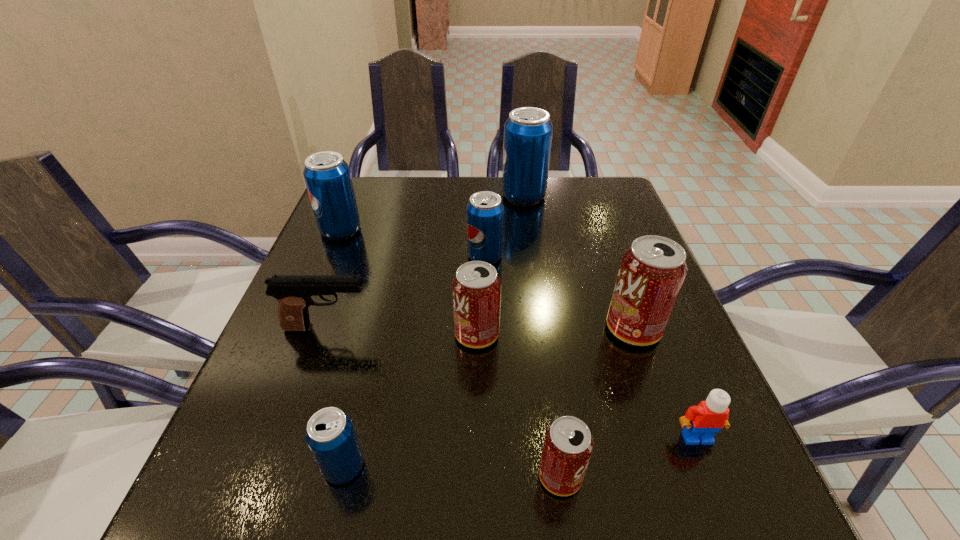
The width and height of the screenshot is (960, 540). What are the coordinates of `vacant region between the tallest object and the leftmost red soda can` in the screenshot? It's located at (500, 265).

At what (x,y) coordinates should I click in order to perform the action: click on free space between the rightmost red soda can and the nearest red soda can. Please return your answer as a coordinate pair (x, y). Looking at the image, I should click on (597, 402).

Point out which object is positioned as the eighth nearest to the black pistol. Please provide its 2D coordinates. Your answer should be formatted as a tuple, i.e. [(x, y)], where the tuple contains the x and y coordinates of a point satisfying the conditions above.

[(702, 422)]

Point out which object is positioned as the eighth nearest to the second nearest blue pop soda. Please provide its 2D coordinates. Your answer should be formatted as a tuple, i.e. [(x, y)], where the tuple contains the x and y coordinates of a point satisfying the conditions above.

[(702, 422)]

Where is `soda can object that ranks as the fifth closest to the nearest red soda can`? This screenshot has width=960, height=540. soda can object that ranks as the fifth closest to the nearest red soda can is located at coordinates (327, 176).

Where is `soda can that stands as the closest to the biggest red soda can`? soda can that stands as the closest to the biggest red soda can is located at coordinates (476, 288).

Select which blue pop soda is the closest to the rightmost soda can. Please provide its 2D coordinates. Your answer should be formatted as a tuple, i.e. [(x, y)], where the tuple contains the x and y coordinates of a point satisfying the conditions above.

[(485, 211)]

Locate which blue pop soda ranks in proximity to the pistol. Please provide its 2D coordinates. Your answer should be formatted as a tuple, i.e. [(x, y)], where the tuple contains the x and y coordinates of a point satisfying the conditions above.

[(330, 434)]

At what (x,y) coordinates should I click in order to perform the action: click on red soda can that is the closest to the nearest red soda can. Please return your answer as a coordinate pair (x, y). The image size is (960, 540). Looking at the image, I should click on (476, 288).

This screenshot has height=540, width=960. What are the coordinates of `red soda can that stands as the second closest to the nearest red soda can` in the screenshot? It's located at (652, 271).